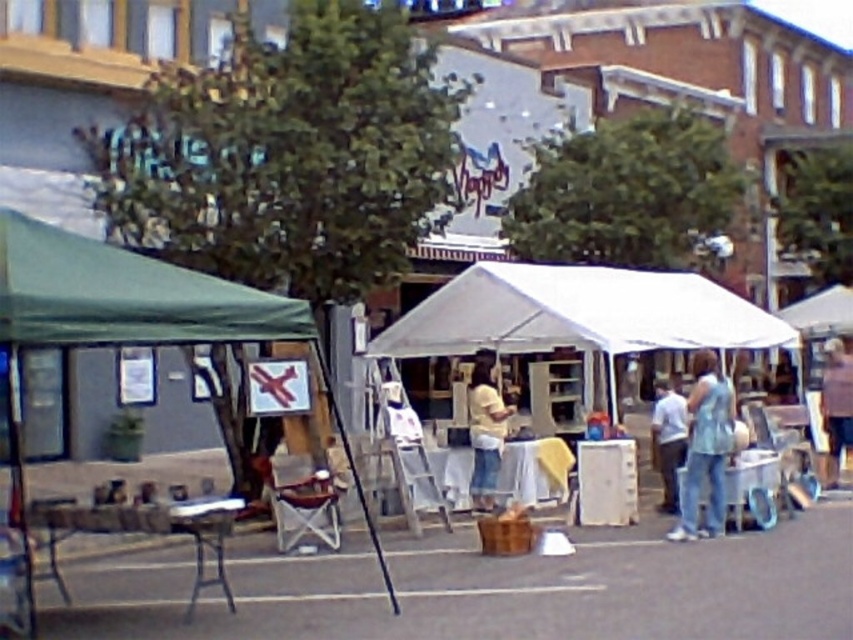
You are a vendor at the market and want to place a new sign that is the same size as the white cotton shirt at center. Can the green fabric canopy at left accommodate this sign without overlapping its edges?

The green fabric canopy at left is smaller than the white cotton shirt at center, so it cannot accommodate a sign of that size without overlapping its edges.

From the picture: You are a vendor at the outdoor market and want to display two items clearly. The yellow cotton shirt at center and the brown fabric jacket at upper right are both hanging on a rack. Which item will require a thicker hanger to avoid slipping?

The brown fabric jacket at upper right requires a thicker hanger because it is thicker than the yellow cotton shirt at center.